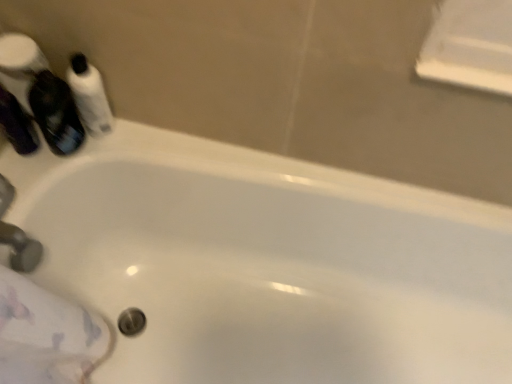
This screenshot has width=512, height=384. What do you see at coordinates (21, 247) in the screenshot?
I see `matte silver faucet at lower left` at bounding box center [21, 247].

The image size is (512, 384). I want to click on matte black bottle at left, marked as the 3th mouthwash in a right-to-left arrangement, so click(17, 124).

At what (x,y) coordinates should I click in order to perform the action: click on white glossy mouthwash at upper left, which appears as the 3th mouthwash when viewed from the left. Please return your answer as a coordinate pair (x, y). This screenshot has height=384, width=512. Looking at the image, I should click on (89, 95).

Where is `translucent purple mouthwash at upper left, which is the second mouthwash from left to right`? This screenshot has height=384, width=512. translucent purple mouthwash at upper left, which is the second mouthwash from left to right is located at coordinates 55,113.

Identify the location of matte silver faucet at lower left. This screenshot has width=512, height=384. (21, 247).

Between translucent purple mouthwash at upper left, positioned as the 2th mouthwash in right-to-left order, and white glossy mouthwash at upper left, which appears as the 3th mouthwash when viewed from the left, which one appears on the right side from the viewer's perspective?

From the viewer's perspective, white glossy mouthwash at upper left, which appears as the 3th mouthwash when viewed from the left, appears more on the right side.

From a real-world perspective, is translucent purple mouthwash at upper left, which is the second mouthwash from left to right, under white glossy mouthwash at upper left, the first mouthwash viewed from the right?

Yes.

From the image's perspective, is translucent purple mouthwash at upper left, positioned as the 2th mouthwash in right-to-left order, on white glossy mouthwash at upper left, the first mouthwash viewed from the right?

No.

Which is behind, point (72, 67) or point (30, 239)?

Point (30, 239)

From a real-world perspective, is white glossy mouthwash at upper left, the first mouthwash viewed from the right, positioned under matte silver faucet at lower left based on gravity?

No, from a real-world perspective, white glossy mouthwash at upper left, the first mouthwash viewed from the right, is not under matte silver faucet at lower left.

Which object is wider, white glossy mouthwash at upper left, the first mouthwash viewed from the right, or matte silver faucet at lower left?

matte silver faucet at lower left.

The image size is (512, 384). Identify the location of faucet in front of the white glossy mouthwash at upper left, the first mouthwash viewed from the right. (21, 247).

Is the depth of matte silver faucet at lower left less than that of white glossy mouthwash at upper left, the first mouthwash viewed from the right?

Yes, the depth of matte silver faucet at lower left is less than that of white glossy mouthwash at upper left, the first mouthwash viewed from the right.

From the image's perspective, does matte silver faucet at lower left appear lower than white glossy mouthwash at upper left, the first mouthwash viewed from the right?

Indeed, from the image's perspective, matte silver faucet at lower left is shown beneath white glossy mouthwash at upper left, the first mouthwash viewed from the right.

Does matte silver faucet at lower left appear on the right side of white glossy mouthwash at upper left, which appears as the 3th mouthwash when viewed from the left?

No, matte silver faucet at lower left is not to the right of white glossy mouthwash at upper left, which appears as the 3th mouthwash when viewed from the left.

Is translucent purple mouthwash at upper left, which is the second mouthwash from left to right, taller or shorter than matte silver faucet at lower left?

In the image, translucent purple mouthwash at upper left, which is the second mouthwash from left to right, appears to be taller than matte silver faucet at lower left.

Is translucent purple mouthwash at upper left, positioned as the 2th mouthwash in right-to-left order, outside of matte silver faucet at lower left?

translucent purple mouthwash at upper left, positioned as the 2th mouthwash in right-to-left order, lies outside matte silver faucet at lower left's area.

From a real-world perspective, is translucent purple mouthwash at upper left, positioned as the 2th mouthwash in right-to-left order, over matte silver faucet at lower left?

Correct, in the physical world, translucent purple mouthwash at upper left, positioned as the 2th mouthwash in right-to-left order, is higher than matte silver faucet at lower left.

Is translucent purple mouthwash at upper left, which is the second mouthwash from left to right, looking in the opposite direction of matte silver faucet at lower left?

translucent purple mouthwash at upper left, which is the second mouthwash from left to right, does not have its back to matte silver faucet at lower left.

Relative to matte black bottle at left, marked as the 3th mouthwash in a right-to-left arrangement, is white glossy mouthwash at upper left, the first mouthwash viewed from the right, in front or behind?

white glossy mouthwash at upper left, the first mouthwash viewed from the right, is positioned farther from the viewer than matte black bottle at left, marked as the 3th mouthwash in a right-to-left arrangement.

Is matte black bottle at left, marked as the 3th mouthwash in a right-to-left arrangement, a part of white glossy mouthwash at upper left, the first mouthwash viewed from the right?

Definitely not — matte black bottle at left, marked as the 3th mouthwash in a right-to-left arrangement, is not inside white glossy mouthwash at upper left, the first mouthwash viewed from the right.

Is white glossy mouthwash at upper left, the first mouthwash viewed from the right, far from matte black bottle at left, marked as the 3th mouthwash in a right-to-left arrangement?

No, white glossy mouthwash at upper left, the first mouthwash viewed from the right, is in close proximity to matte black bottle at left, marked as the 3th mouthwash in a right-to-left arrangement.

Which is more to the left, white glossy mouthwash at upper left, the first mouthwash viewed from the right, or matte black bottle at left, marked as the 3th mouthwash in a right-to-left arrangement?

Positioned to the left is matte black bottle at left, marked as the 3th mouthwash in a right-to-left arrangement.

There is a matte black bottle at left, the 1th mouthwash viewed from the left. Where is `the 1st mouthwash above it (from the image's perspective)`? the 1st mouthwash above it (from the image's perspective) is located at coordinates [55, 113].

Is matte black bottle at left, the 1th mouthwash viewed from the left, further to camera compared to translucent purple mouthwash at upper left, positioned as the 2th mouthwash in right-to-left order?

Yes, matte black bottle at left, the 1th mouthwash viewed from the left, is further from the viewer.

How many degrees apart are the facing directions of matte black bottle at left, the 1th mouthwash viewed from the left, and translucent purple mouthwash at upper left, which is the second mouthwash from left to right?

There is a 1.97-degree angle between the facing directions of matte black bottle at left, the 1th mouthwash viewed from the left, and translucent purple mouthwash at upper left, which is the second mouthwash from left to right.

Would you say translucent purple mouthwash at upper left, which is the second mouthwash from left to right, is to the left or to the right of matte black bottle at left, the 1th mouthwash viewed from the left, in the picture?

translucent purple mouthwash at upper left, which is the second mouthwash from left to right, is to the right of matte black bottle at left, the 1th mouthwash viewed from the left.

Is translucent purple mouthwash at upper left, which is the second mouthwash from left to right, directly adjacent to matte black bottle at left, marked as the 3th mouthwash in a right-to-left arrangement?

Yes, translucent purple mouthwash at upper left, which is the second mouthwash from left to right, is beside matte black bottle at left, marked as the 3th mouthwash in a right-to-left arrangement.

Is translucent purple mouthwash at upper left, which is the second mouthwash from left to right, looking in the opposite direction of matte black bottle at left, the 1th mouthwash viewed from the left?

No, translucent purple mouthwash at upper left, which is the second mouthwash from left to right,'s orientation is not away from matte black bottle at left, the 1th mouthwash viewed from the left.

Find the location of a particular element. This screenshot has width=512, height=384. the 2nd mouthwash behind the translucent purple mouthwash at upper left, which is the second mouthwash from left to right is located at coordinates (89, 95).

This screenshot has width=512, height=384. In order to click on faucet below the white glossy mouthwash at upper left, which appears as the 3th mouthwash when viewed from the left (from the image's perspective) in this screenshot , I will do `click(21, 247)`.

Based on their spatial positions, is matte black bottle at left, marked as the 3th mouthwash in a right-to-left arrangement, or matte silver faucet at lower left further from translucent purple mouthwash at upper left, positioned as the 2th mouthwash in right-to-left order?

Based on the image, matte silver faucet at lower left appears to be further to translucent purple mouthwash at upper left, positioned as the 2th mouthwash in right-to-left order.

When comparing their distances from matte black bottle at left, the 1th mouthwash viewed from the left, does matte silver faucet at lower left or translucent purple mouthwash at upper left, which is the second mouthwash from left to right, seem further?

matte silver faucet at lower left is further to matte black bottle at left, the 1th mouthwash viewed from the left.

Based on their spatial positions, is translucent purple mouthwash at upper left, positioned as the 2th mouthwash in right-to-left order, or matte silver faucet at lower left closer to white glossy mouthwash at upper left, the first mouthwash viewed from the right?

Among the two, translucent purple mouthwash at upper left, positioned as the 2th mouthwash in right-to-left order, is located nearer to white glossy mouthwash at upper left, the first mouthwash viewed from the right.

Considering their positions, is translucent purple mouthwash at upper left, which is the second mouthwash from left to right, positioned further to white glossy mouthwash at upper left, the first mouthwash viewed from the right, than matte black bottle at left, the 1th mouthwash viewed from the left?

Among the two, matte black bottle at left, the 1th mouthwash viewed from the left, is located further to white glossy mouthwash at upper left, the first mouthwash viewed from the right.

Considering their positions, is matte silver faucet at lower left positioned closer to white glossy mouthwash at upper left, which appears as the 3th mouthwash when viewed from the left, than translucent purple mouthwash at upper left, positioned as the 2th mouthwash in right-to-left order?

Based on the image, translucent purple mouthwash at upper left, positioned as the 2th mouthwash in right-to-left order, appears to be nearer to white glossy mouthwash at upper left, which appears as the 3th mouthwash when viewed from the left.

Looking at the image, which one is located closer to matte black bottle at left, the 1th mouthwash viewed from the left, translucent purple mouthwash at upper left, which is the second mouthwash from left to right, or matte silver faucet at lower left?

The object closer to matte black bottle at left, the 1th mouthwash viewed from the left, is translucent purple mouthwash at upper left, which is the second mouthwash from left to right.

Considering their positions, is matte silver faucet at lower left positioned further to translucent purple mouthwash at upper left, positioned as the 2th mouthwash in right-to-left order, than white glossy mouthwash at upper left, which appears as the 3th mouthwash when viewed from the left?

Among the two, matte silver faucet at lower left is located further to translucent purple mouthwash at upper left, positioned as the 2th mouthwash in right-to-left order.

Based on their spatial positions, is matte silver faucet at lower left or white glossy mouthwash at upper left, which appears as the 3th mouthwash when viewed from the left, closer to matte black bottle at left, the 1th mouthwash viewed from the left?

Among the two, white glossy mouthwash at upper left, which appears as the 3th mouthwash when viewed from the left, is located nearer to matte black bottle at left, the 1th mouthwash viewed from the left.

Where is `mouthwash situated between matte black bottle at left, marked as the 3th mouthwash in a right-to-left arrangement, and white glossy mouthwash at upper left, the first mouthwash viewed from the right, from left to right`? mouthwash situated between matte black bottle at left, marked as the 3th mouthwash in a right-to-left arrangement, and white glossy mouthwash at upper left, the first mouthwash viewed from the right, from left to right is located at coordinates (55, 113).

What are the coordinates of `mouthwash between translucent purple mouthwash at upper left, which is the second mouthwash from left to right, and matte silver faucet at lower left from top to bottom` in the screenshot? It's located at (17, 124).